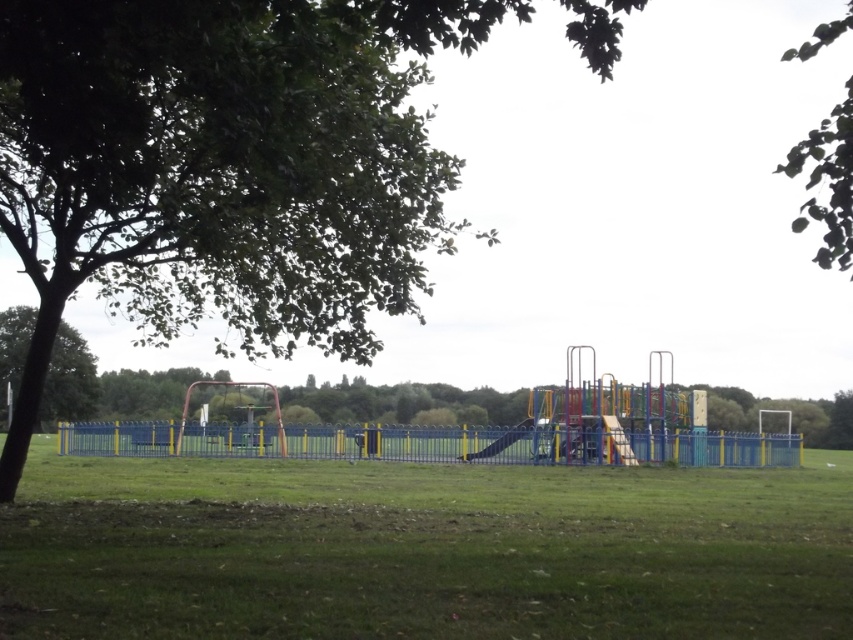
Can you confirm if green leafy tree at upper left is positioned above green leafy tree at upper right?

Incorrect, green leafy tree at upper left is not positioned above green leafy tree at upper right.

Is green leafy tree at upper left behind green leafy tree at upper right?

Yes, it is.

Is point (291, 198) in front of point (791, 164)?

No, it is not.

Find the location of a particular element. This screenshot has width=853, height=640. green leafy tree at upper left is located at coordinates (224, 166).

Which is more to the right, green leafy tree at left or smooth plastic slide at center?

smooth plastic slide at center is more to the right.

Between green leafy tree at left and smooth plastic slide at center, which one is positioned higher?

Positioned higher is green leafy tree at left.

This screenshot has width=853, height=640. Find the location of `green leafy tree at left`. green leafy tree at left is located at coordinates (68, 380).

Is green grassy field at center wider than green leafy tree at upper right?

Yes, green grassy field at center is wider than green leafy tree at upper right.

Which is more to the right, green grassy field at center or green leafy tree at upper right?

green leafy tree at upper right is more to the right.

What are the coordinates of `green grassy field at center` in the screenshot? It's located at (422, 548).